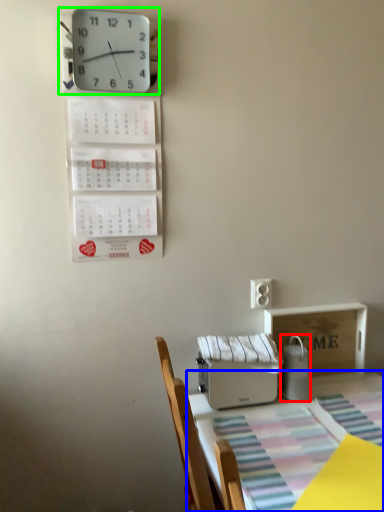
Question: Considering the real-world distances, which object is closest to appliance (highlighted by a red box)? table (highlighted by a blue box) or wall clock (highlighted by a green box).

Choices:
 (A) table
 (B) wall clock

Answer: (A)